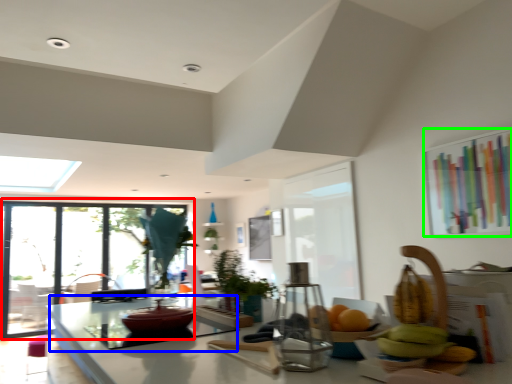
Question: Which object is positioned farthest from window (highlighted by a red box)? Select from glass table (highlighted by a blue box) and window screen (highlighted by a green box).

Choices:
 (A) glass table
 (B) window screen

Answer: (B)